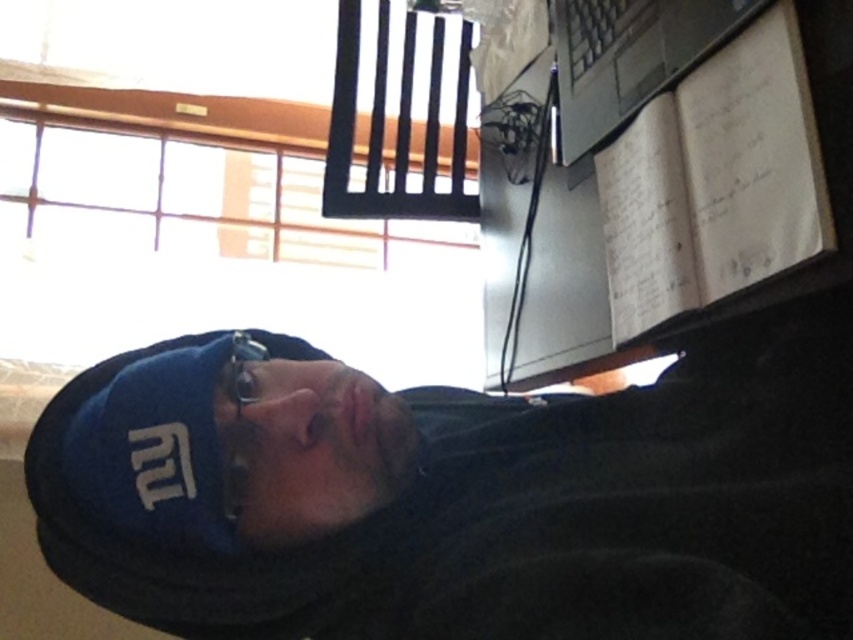
You are standing in a home office and notice the blue fabric cap at upper left. Based on its position, can you determine if it is closer to the window or the person in the image?

The blue fabric cap at upper left is located at point [460,497], which places it closer to the window than the person in the image.

You are a delivery person who needs to place a small package between the blue fabric cap at upper left and the black plastic laptop at upper right. The package is 10 inches long. Can you fit it between them without moving either object?

The blue fabric cap at upper left is 17.57 inches away from the black plastic laptop at upper right. Since the package is 10 inches long, it can fit between them as there is enough space.

You are organizing a desk and need to place the black plastic laptop at upper right and the metallic reflective glasses at center. Based on their positions, which object is closer to you?

The black plastic laptop at upper right is closer to you because it is further to the viewer than the metallic reflective glasses at center.